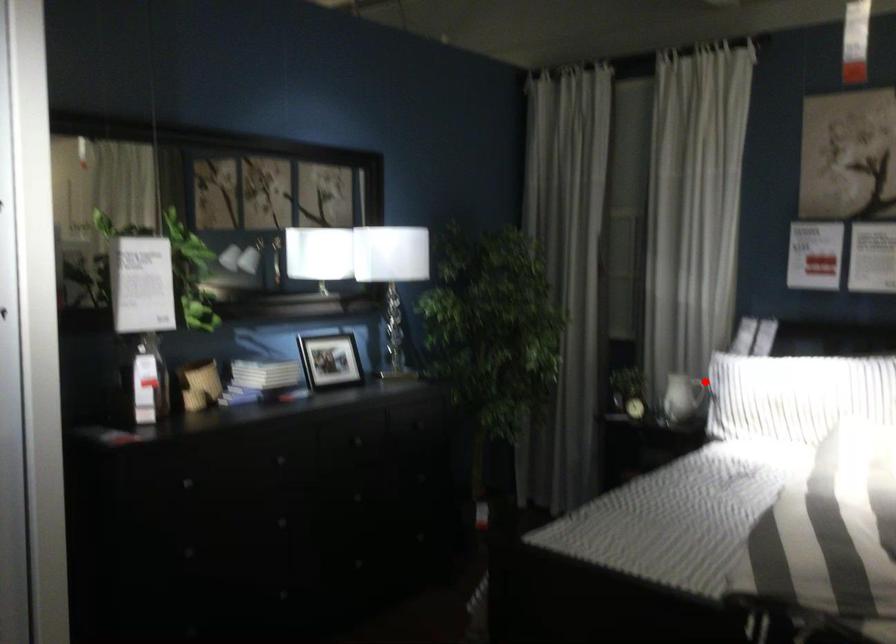
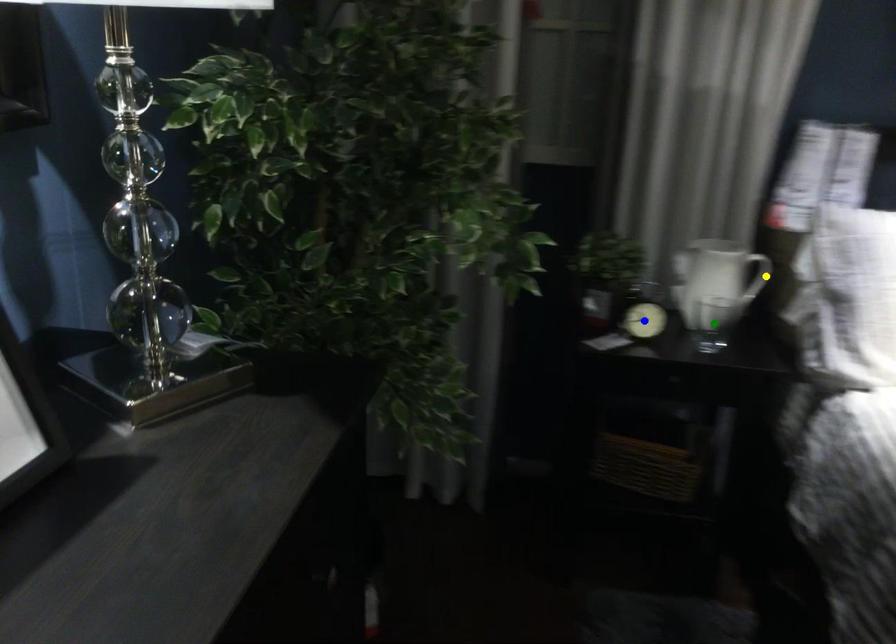
Question: I am providing you with two images of the same scene from different viewpoints. A red point is marked on the first image. You are given multiple points on the second image. Can you choose the point in image 2 that corresponds to the point in image 1?

Choices:
 (A) yellow point
 (B) blue point
 (C) green point

Answer: (A)